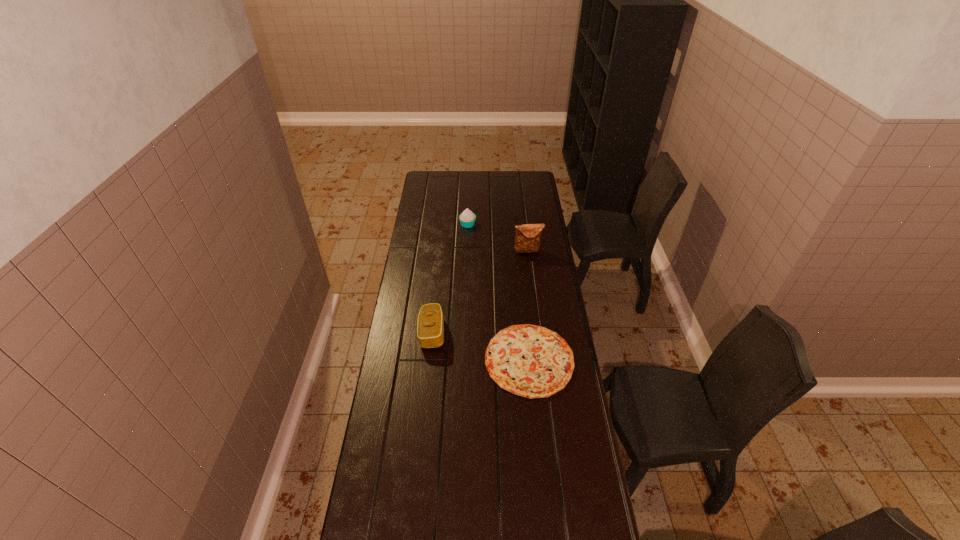
The image size is (960, 540). What are the coordinates of `the farther clutch bag` in the screenshot? It's located at (527, 239).

I want to click on the right clutch bag, so click(x=527, y=239).

In order to click on cupcake in this screenshot , I will do [x=467, y=218].

Find the location of a particular element. This screenshot has height=540, width=960. the farthest object is located at coordinates (467, 218).

Where is `the shorter clutch bag`? the shorter clutch bag is located at coordinates pos(430,329).

At what (x,y) coordinates should I click in order to perform the action: click on the left clutch bag. Please return your answer as a coordinate pair (x, y). Looking at the image, I should click on (430, 329).

You are a GUI agent. You are given a task and a screenshot of the screen. Output one action in this format:
    pyautogui.click(x=<x>, y=<y>)
    Task: Click on the pizza
    
    Given the screenshot: What is the action you would take?
    527,360

Image resolution: width=960 pixels, height=540 pixels. In order to click on vacant region located on the open side of the farther clutch bag in this screenshot , I will do `click(535, 304)`.

The width and height of the screenshot is (960, 540). Find the location of `vacant space located 0.330m on the right of the farthest object`. vacant space located 0.330m on the right of the farthest object is located at coordinates (537, 224).

Locate an element on the screen. vacant space located 0.120m on the zipper side of the shorter clutch bag is located at coordinates (473, 333).